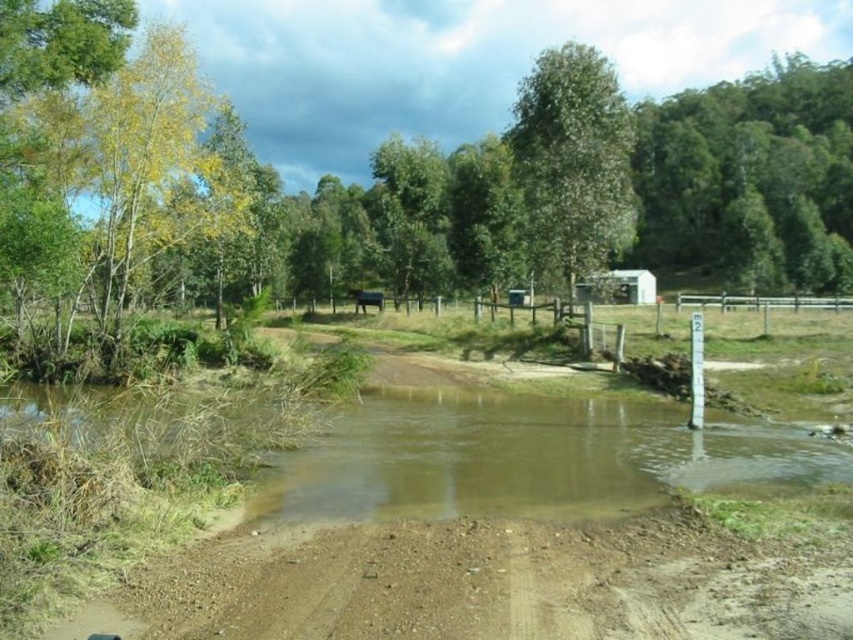
Is yellow-green foliage at upper left further to camera compared to green leafy trees at upper right?

No.

Is yellow-green foliage at upper left smaller than green leafy trees at upper right?

Yes.

You are a GUI agent. You are given a task and a screenshot of the screen. Output one action in this format:
    pyautogui.click(x=<x>, y=<y>)
    Task: Click on the yellow-green foliage at upper left
    This screenshot has height=640, width=853.
    Given the screenshot: What is the action you would take?
    pyautogui.click(x=108, y=189)

Which is more to the left, yellow-green foliage at upper left or green leafy tree at upper center?

yellow-green foliage at upper left is more to the left.

Which is behind, point (51, 4) or point (585, 67)?

The point (585, 67) is more distant.

I want to click on yellow-green foliage at upper left, so click(x=108, y=189).

Does green leafy trees at upper right appear under green leafy tree at upper center?

Incorrect, green leafy trees at upper right is not positioned below green leafy tree at upper center.

Can you confirm if green leafy trees at upper right is smaller than green leafy tree at upper center?

Incorrect, green leafy trees at upper right is not smaller in size than green leafy tree at upper center.

The height and width of the screenshot is (640, 853). In order to click on green leafy trees at upper right in this screenshot , I will do `click(751, 179)`.